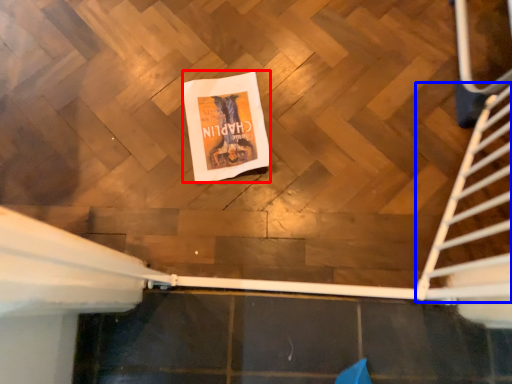
Question: Which point is closer to the camera, flyer (highlighted by a red box) or stairs (highlighted by a blue box)?

Choices:
 (A) flyer
 (B) stairs

Answer: (B)